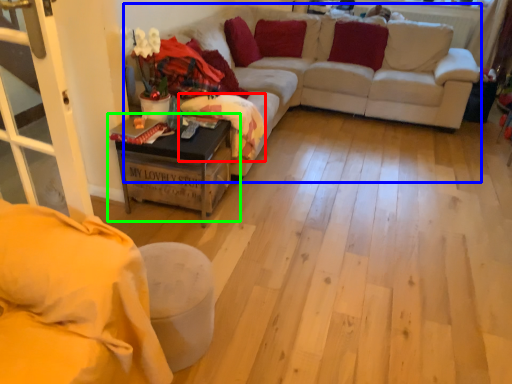
Question: Considering the real-world distances, which object is farthest from blanket (highlighted by a red box)? couch (highlighted by a blue box) or table (highlighted by a green box)?

Choices:
 (A) couch
 (B) table

Answer: (A)